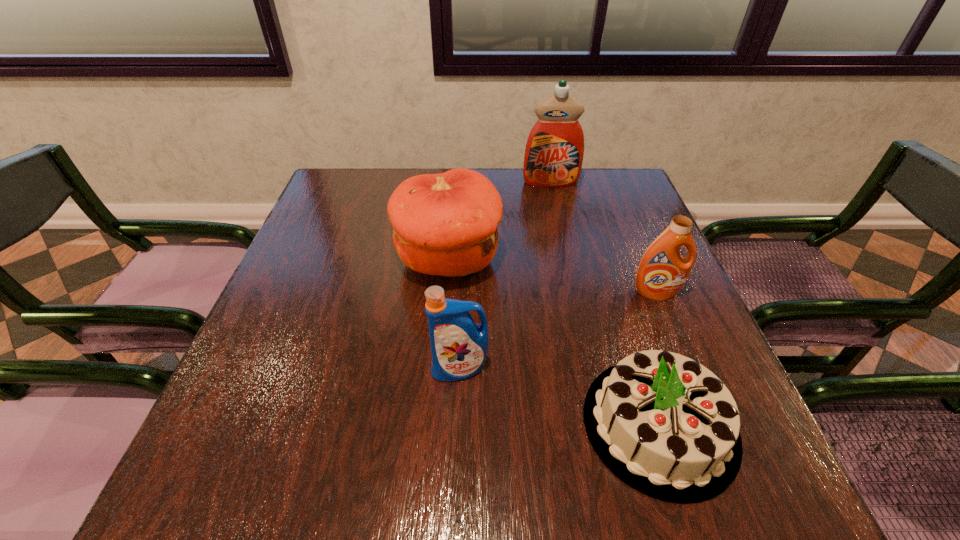
Locate an element on the screen. vacant space that's between the pumpkin and the rightmost detergent is located at coordinates pyautogui.click(x=552, y=276).

Locate an element on the screen. This screenshot has height=540, width=960. vacant area that lies between the rightmost detergent and the farthest detergent is located at coordinates (603, 238).

Identify the location of free point between the leftmost detergent and the farthest detergent. This screenshot has width=960, height=540. (505, 275).

This screenshot has height=540, width=960. Find the location of `free space between the second detergent from right to left and the birthday cake`. free space between the second detergent from right to left and the birthday cake is located at coordinates (605, 303).

This screenshot has width=960, height=540. Identify the location of free space between the farthest object and the shortest object. (605, 303).

At what (x,y) coordinates should I click in order to perform the action: click on vacant area between the shortest object and the leftmost detergent. Please return your answer as a coordinate pair (x, y). This screenshot has height=540, width=960. Looking at the image, I should click on (560, 396).

Select which object is the fourth closest to the birthday cake. Please provide its 2D coordinates. Your answer should be formatted as a tuple, i.e. [(x, y)], where the tuple contains the x and y coordinates of a point satisfying the conditions above.

[(554, 151)]

Choose which object is the second nearest neighbor to the pumpkin. Please provide its 2D coordinates. Your answer should be formatted as a tuple, i.e. [(x, y)], where the tuple contains the x and y coordinates of a point satisfying the conditions above.

[(554, 151)]

Find the location of a particular element. The image size is (960, 540). detergent identified as the second closest to the pumpkin is located at coordinates (554, 151).

You are a GUI agent. You are given a task and a screenshot of the screen. Output one action in this format:
    pyautogui.click(x=<x>, y=<y>)
    Task: Click on the detergent that is the second closest one to the second detergent from right to left
    This screenshot has width=960, height=540.
    Given the screenshot: What is the action you would take?
    pyautogui.click(x=459, y=346)